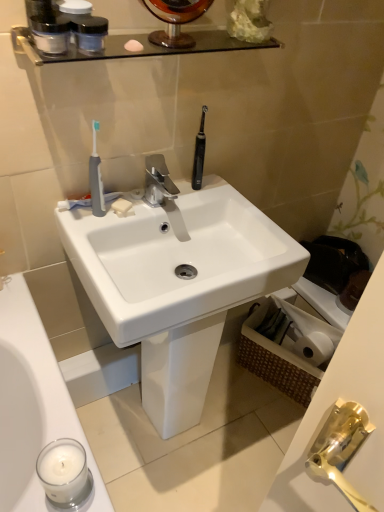
This screenshot has height=512, width=384. What are the coordinates of `vacant area that is situated to the right of white matte soap at center` in the screenshot? It's located at (182, 200).